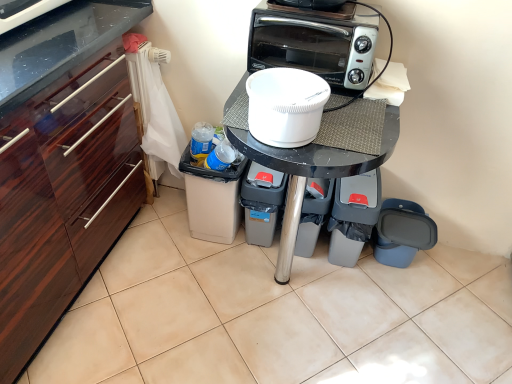
Where is `vacant space to the right of blue plastic trash can at lower right, which appears as the fourth appliance when viewed from the left`? vacant space to the right of blue plastic trash can at lower right, which appears as the fourth appliance when viewed from the left is located at coordinates (449, 276).